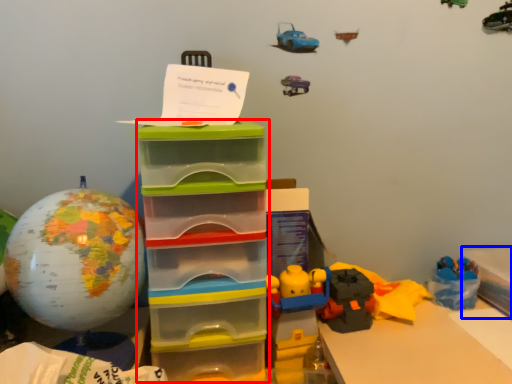
Question: Which of the following is the farthest to the observer, storage box (highlighted by a red box) or storage box (highlighted by a blue box)?

Choices:
 (A) storage box
 (B) storage box

Answer: (B)